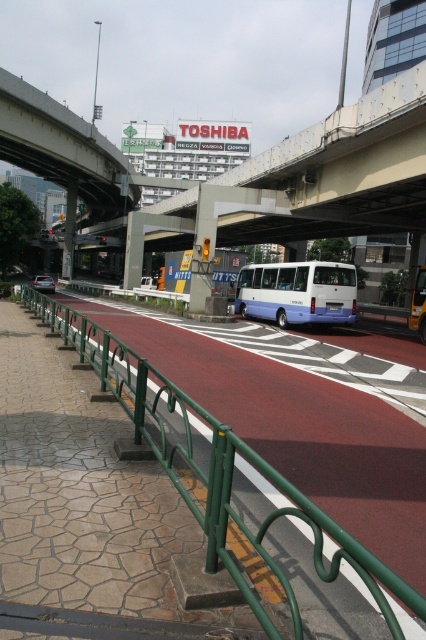
You are a pedestrian standing on the sidewalk near the green metallic rail at lower left and want to cross the road to reach the white matte bus at center. Is the bus visible to you from your current position?

The green metallic rail at lower left is in front of the white matte bus at center, so the bus is blocked by the rail and not visible from your current position.

You are a delivery person trying to navigate through the intersection. The green metallic rail at lower left and the white matte bus at center are in your path. Which object should you avoid to stay within the road? Please explain your reasoning.

The green metallic rail at lower left is on the sidewalk, while the white matte bus at center is in the road. Since the bus is in the road, you should avoid the white matte bus at center to stay within the road.

You are standing at point (x=218, y=470) in the image. What object is directly in front of you?

The green metallic rail at lower left is directly in front of you at point (x=218, y=470).